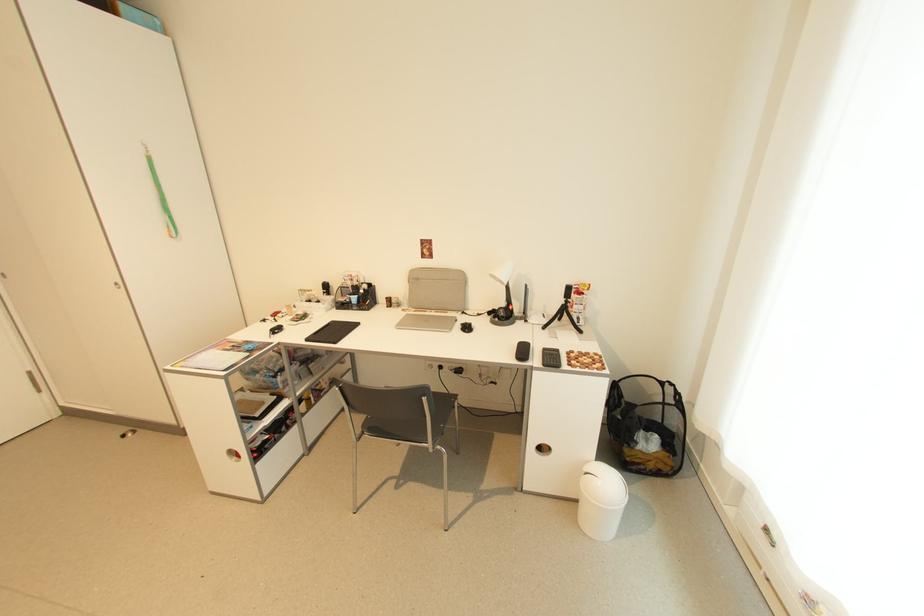
This screenshot has height=616, width=924. What are the coordinates of `cabinet hole handle` in the screenshot? It's located at (233, 455).